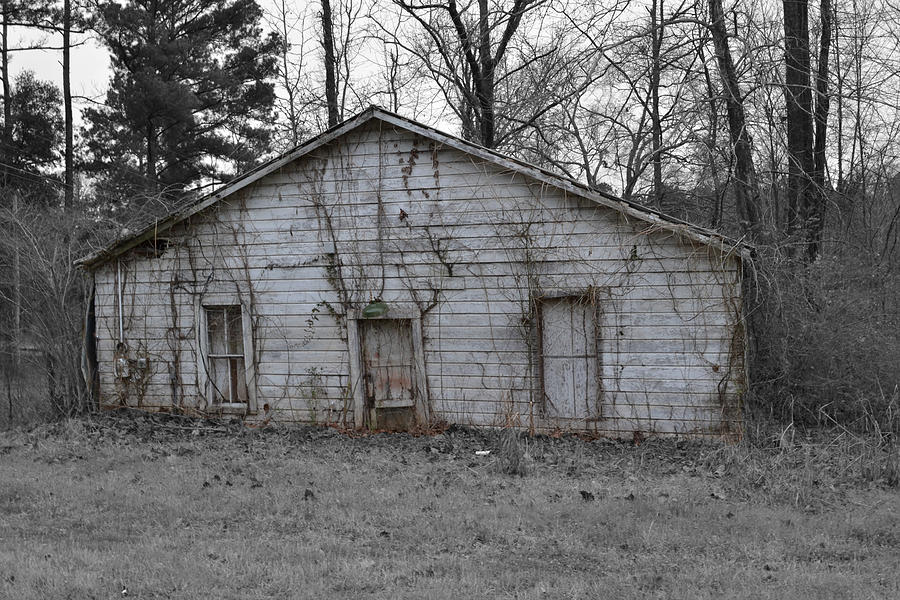
The width and height of the screenshot is (900, 600). Identify the location of boarded up window. (569, 326), (560, 368).